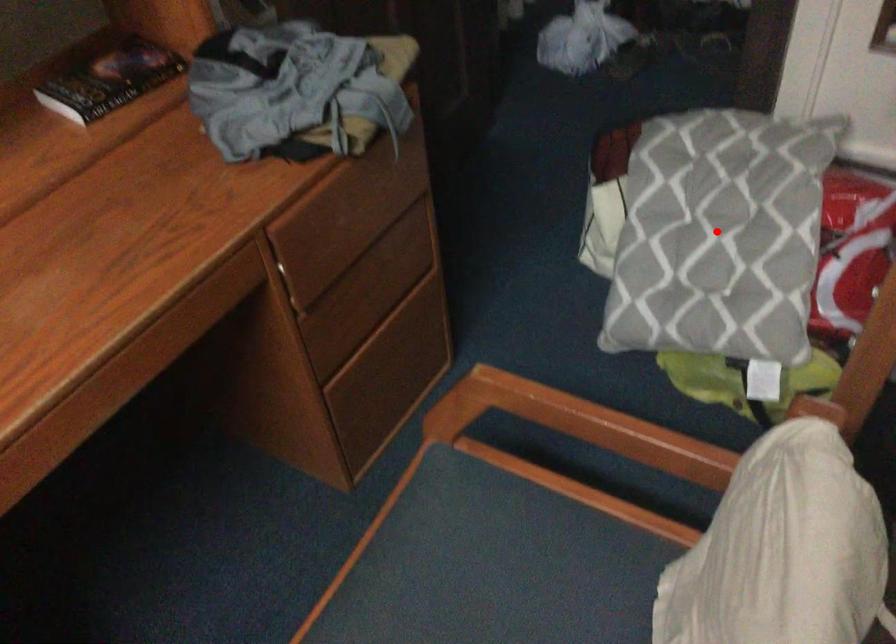
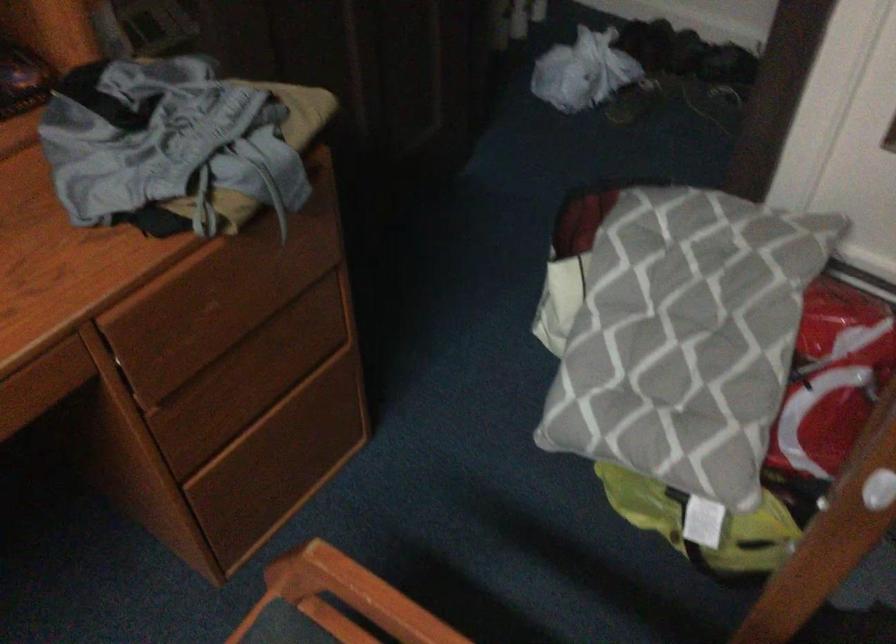
Where in the second image is the point corresponding to the highlighted location from the first image?

(677, 335)